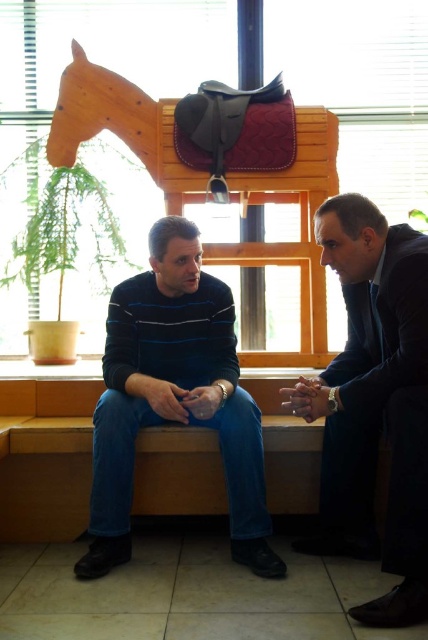
Describe the element at coordinates (374, 403) in the screenshot. I see `dark blue suit at center` at that location.

Who is more forward, (397, 497) or (211, 294)?

Positioned in front is point (397, 497).

Does point (404, 317) come behind point (104, 518)?

That is False.

The image size is (428, 640). Find the location of `dark blue suit at center`. dark blue suit at center is located at coordinates (374, 403).

Can you confirm if dark blue suit at center is positioned below wooden horse at upper center?

Correct, dark blue suit at center is located below wooden horse at upper center.

Where is `dark blue suit at center`? This screenshot has height=640, width=428. dark blue suit at center is located at coordinates (374, 403).

At what (x,y) coordinates should I click in order to perform the action: click on dark blue suit at center. Please return your answer as a coordinate pair (x, y). This screenshot has height=640, width=428. Looking at the image, I should click on (374, 403).

Can you confirm if dark blue striped sweater at center is bigger than wooden horse at upper center?

Incorrect, dark blue striped sweater at center is not larger than wooden horse at upper center.

Who is more distant from viewer, (184, 328) or (335, 157)?

Point (335, 157)

Measure the distance between dark blue striped sweater at center and camera.

They are 5.79 feet apart.

Where is `dark blue striped sweater at center`? dark blue striped sweater at center is located at coordinates (174, 397).